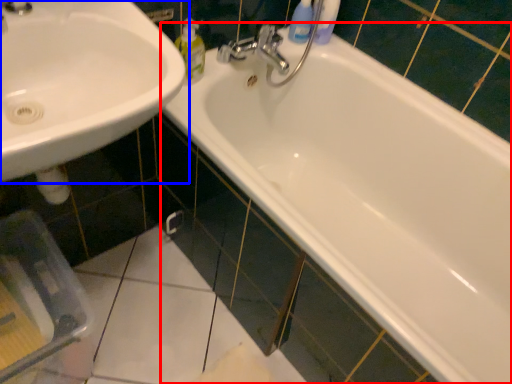
Question: Which point is further to the camera, bathtub (highlighted by a red box) or sink (highlighted by a blue box)?

Choices:
 (A) bathtub
 (B) sink

Answer: (A)